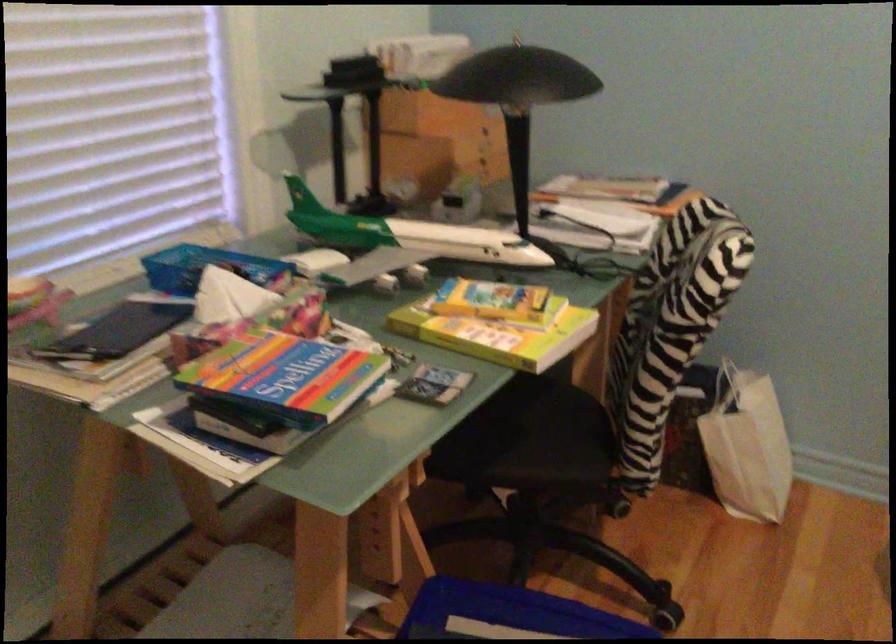
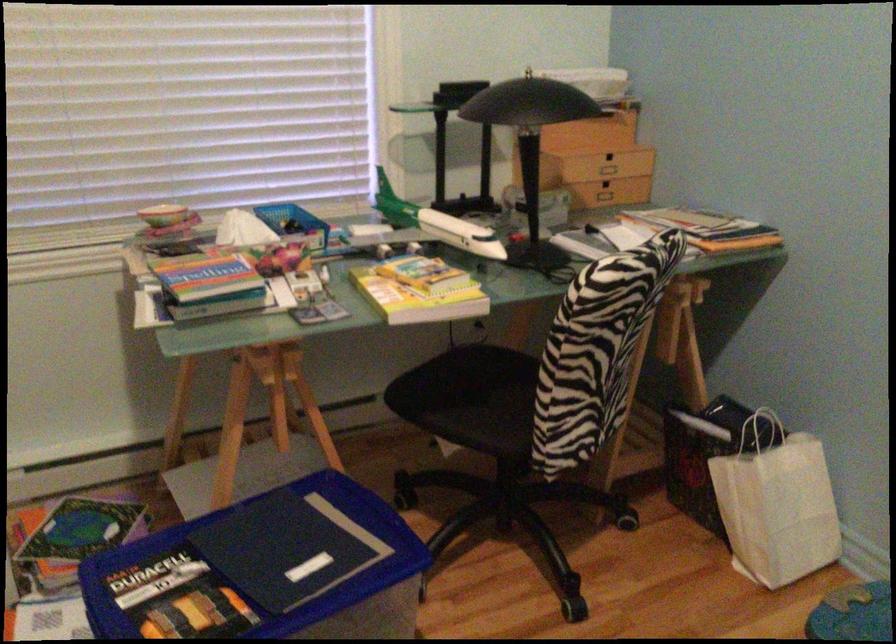
Where in the second image is the point corresponding to pixel 490 140 from the first image?

(610, 166)